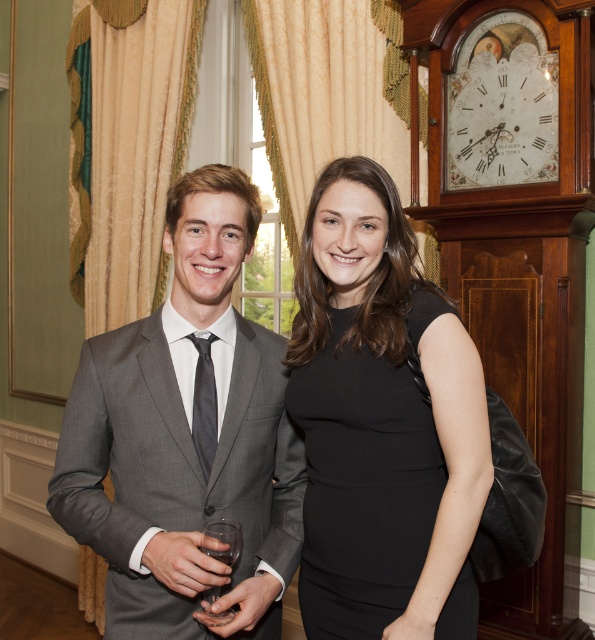
Does black satin tie at center have a greater width compared to clear glass wine glass at center?

In fact, black satin tie at center might be narrower than clear glass wine glass at center.

Who is positioned more to the left, black satin tie at center or clear glass wine glass at center?

black satin tie at center is more to the left.

Is point (211, 422) less distant than point (228, 538)?

No.

Locate an element on the screen. black satin tie at center is located at coordinates (205, 404).

Which is above, black matte dress at center or white paper clock face at upper right?

white paper clock face at upper right is above.

Does black matte dress at center have a greater width compared to white paper clock face at upper right?

Indeed, black matte dress at center has a greater width compared to white paper clock face at upper right.

Find the location of a particular element. black matte dress at center is located at coordinates (361, 484).

Is gray suit at center behind black satin tie at center?

No, gray suit at center is in front of black satin tie at center.

This screenshot has height=640, width=595. I want to click on gray suit at center, so click(x=184, y=436).

At what (x,y) coordinates should I click in order to perform the action: click on gray suit at center. Please return your answer as a coordinate pair (x, y). The width and height of the screenshot is (595, 640). Looking at the image, I should click on (184, 436).